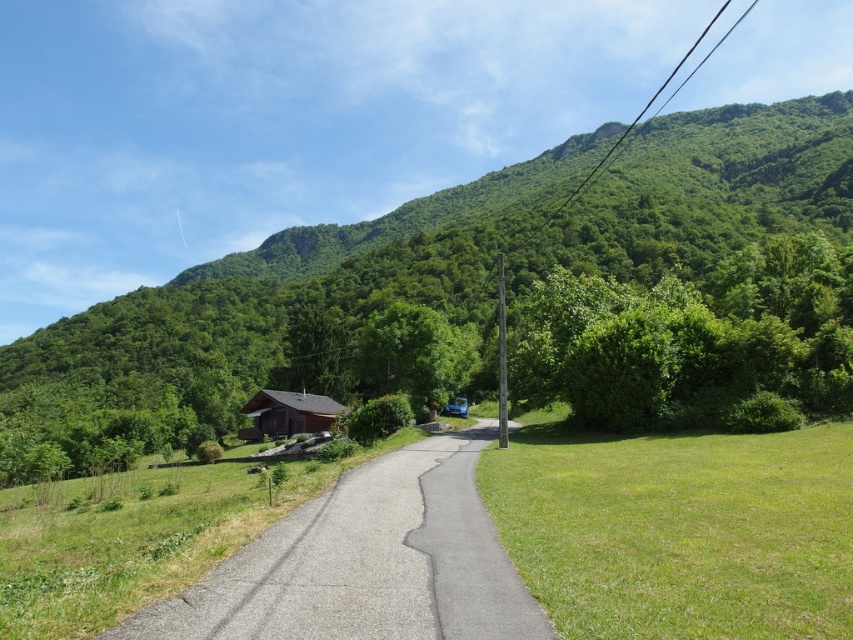
You are a drone operator trying to capture a clear aerial shot of the green leafy tree at center and the gray asphalt driveway at center. From your current position, which object is higher in the scene?

The green leafy tree at center is above the gray asphalt driveway at center, so the green leafy tree at center is higher in the scene.

Consider the image. You are standing at the point labeled point (x=366, y=563) which is the gray asphalt driveway at center. You want to walk towards the blue vehicle parked near the small wooden structure on the left side of the road. Which direction should you head?

You should head towards the left side of the road since the blue vehicle is parked near the small wooden structure on the left side of the road.